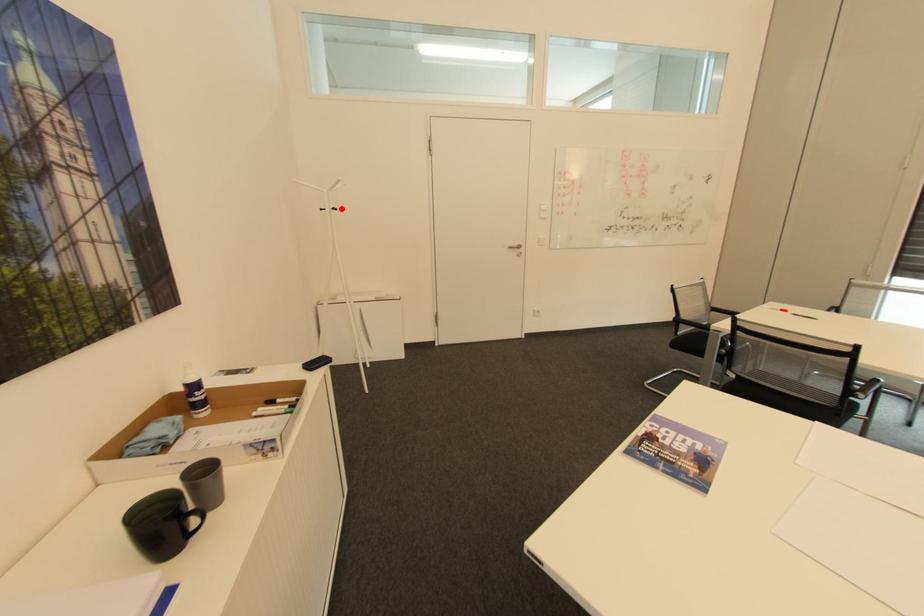
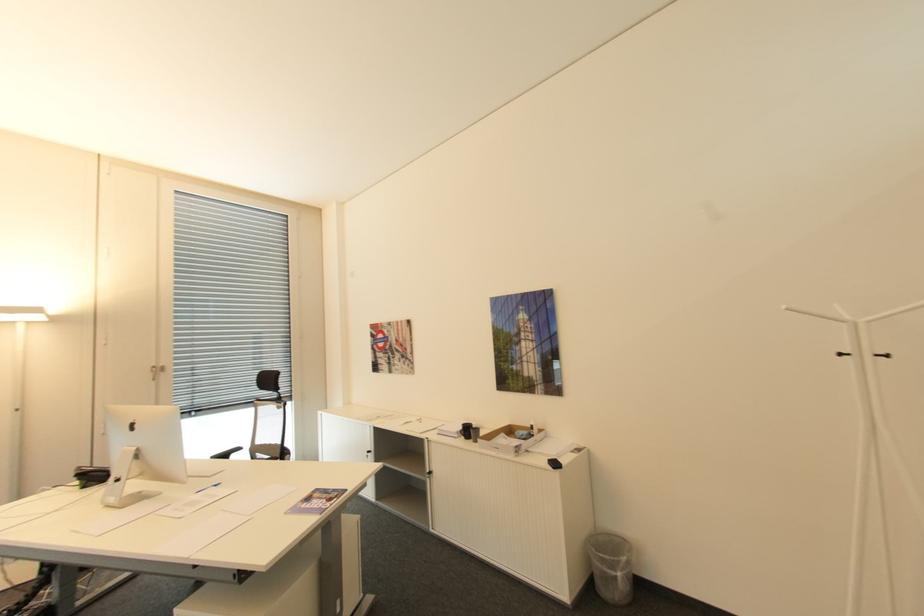
Question: I am providing you with two images of the same scene from different viewpoints. A red point is marked on the first image. Is the red point's position out of view in image 2?

Choices:
 (A) Yes
 (B) No

Answer: (B)